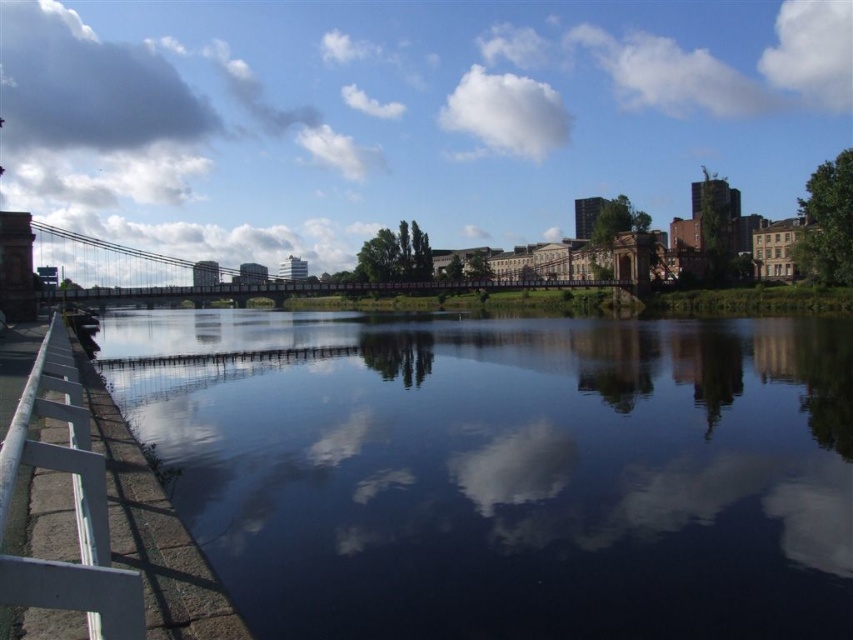
Looking at this image, you are standing at the point closer to the camera in the image. Which point are you at, point (65, 404) or point (138, 296)?

You are at point (65, 404) because it is closer to the camera than point (138, 296).